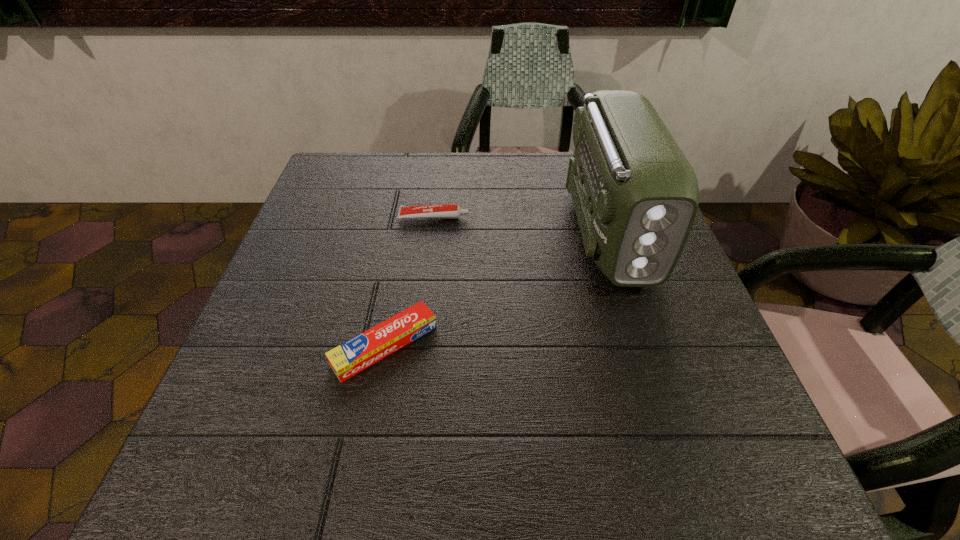
Locate an element on the screen. Image resolution: width=960 pixels, height=540 pixels. radio_receiver is located at coordinates point(635,194).

At what (x,y) coordinates should I click in order to perform the action: click on the tallest object. Please return your answer as a coordinate pair (x, y). Looking at the image, I should click on (635, 194).

Locate an element on the screen. The width and height of the screenshot is (960, 540). the nearer toothpaste is located at coordinates (353, 356).

Find the location of `the farther toothpaste`. the farther toothpaste is located at coordinates (445, 211).

Where is `vacant space located on the front-facing side of the tallest object`? Image resolution: width=960 pixels, height=540 pixels. vacant space located on the front-facing side of the tallest object is located at coordinates (676, 433).

Where is `vacant space situated 0.130m on the right of the nearest object`? vacant space situated 0.130m on the right of the nearest object is located at coordinates (511, 346).

The image size is (960, 540). In order to click on vacant space located 0.320m at the nozzle of the farther toothpaste in this screenshot , I will do `click(608, 217)`.

Image resolution: width=960 pixels, height=540 pixels. What are the coordinates of `object positioned at the far edge` in the screenshot? It's located at (635, 194).

Where is `object that is at the left edge`? object that is at the left edge is located at coordinates (353, 356).

At what (x,y) coordinates should I click in order to perform the action: click on object that is at the right edge. Please return your answer as a coordinate pair (x, y). The image size is (960, 540). Looking at the image, I should click on (635, 194).